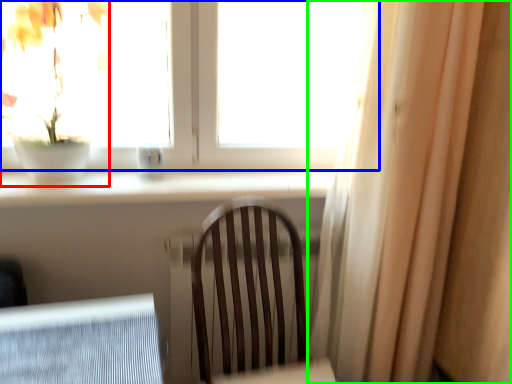
Question: Which object is the farthest from houseplant (highlighted by a red box)? Choose among these: window (highlighted by a blue box) or curtain (highlighted by a green box).

Choices:
 (A) window
 (B) curtain

Answer: (B)